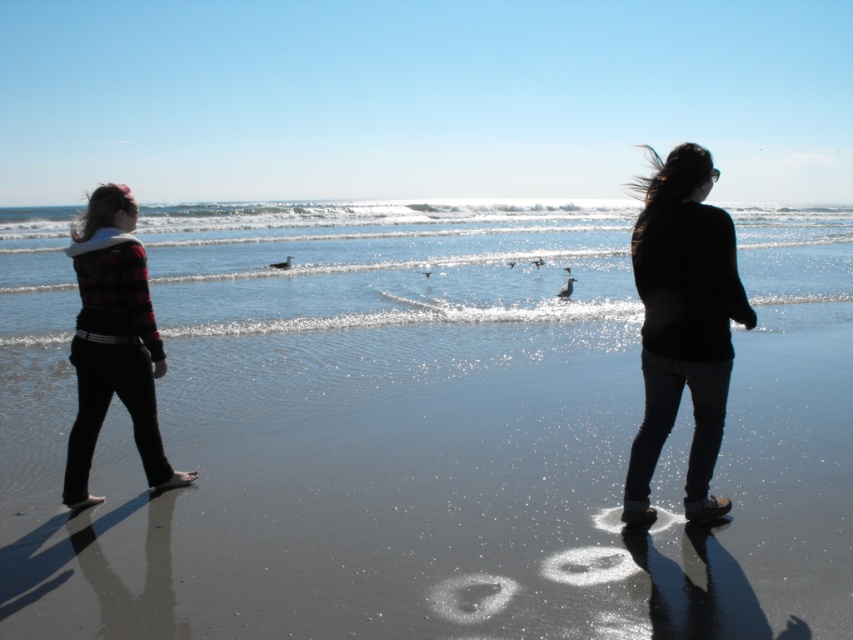
You are standing on the beach and see both the black matte sweater at center and the plaid fabric jacket at left. Which clothing item is nearer to you?

The black matte sweater at center is closer to the viewer than the plaid fabric jacket at left.

You are a photographer trying to capture the black matte sweater at center in the scene. Where should you position your camera to ensure it is in the frame?

Position your camera at a point where the black matte sweater at center is visible. Since the sweater is located at coordinates point (683, 323), align the camera to capture that specific coordinate to include the sweater in the frame.